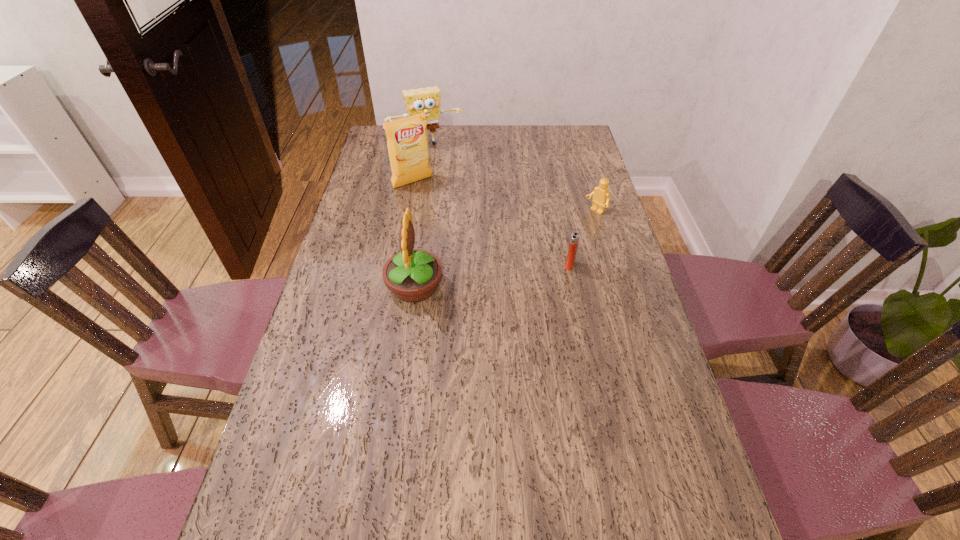
The image size is (960, 540). What are the coordinates of `sunflower` in the screenshot? It's located at (412, 275).

Where is `the fourth object from left to right`? Image resolution: width=960 pixels, height=540 pixels. the fourth object from left to right is located at coordinates (574, 240).

This screenshot has height=540, width=960. What are the coordinates of `sponge` in the screenshot? It's located at (420, 100).

Where is `the third farthest object`? The width and height of the screenshot is (960, 540). the third farthest object is located at coordinates (601, 196).

This screenshot has width=960, height=540. In order to click on the rightmost object in this screenshot , I will do `click(601, 196)`.

Where is `crisp (potato chip)`? The height and width of the screenshot is (540, 960). crisp (potato chip) is located at coordinates (407, 141).

This screenshot has width=960, height=540. Find the location of `vacant region located 0.180m on the face of the sunflower`. vacant region located 0.180m on the face of the sunflower is located at coordinates (324, 286).

Find the location of a particular element. This screenshot has width=960, height=540. vacant area situated 0.090m on the face of the sunflower is located at coordinates (355, 286).

Find the location of `blank space located on the left of the second object from right to left`. blank space located on the left of the second object from right to left is located at coordinates (472, 265).

I want to click on vacant area situated on the face of the sponge, so click(x=446, y=174).